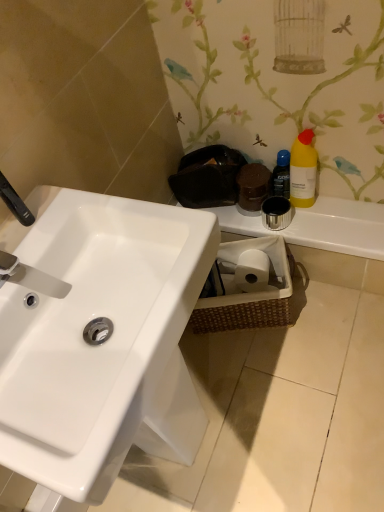
The width and height of the screenshot is (384, 512). In order to click on unoccupied region to the right of woven brown basket at lower right in this screenshot , I will do `click(336, 310)`.